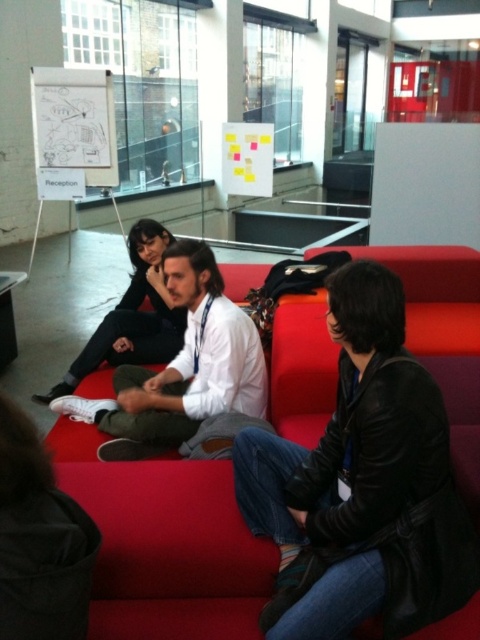
Which is above, white matte shirt at center or matte black jacket at center?

Positioned higher is matte black jacket at center.

I want to click on white matte shirt at center, so click(x=181, y=369).

Which is below, red leather couch at center or matte black jacket at center?

matte black jacket at center is lower down.

Is red leather couch at center positioned at the back of matte black jacket at center?

No.

From the picture: Who is more distant from viewer, [288,438] or [157,252]?

Positioned behind is point [157,252].

The image size is (480, 640). I want to click on red leather couch at center, so click(166, 544).

Can you confirm if red leather couch at center is smaller than white matte shirt at center?

Actually, red leather couch at center might be larger than white matte shirt at center.

Measure the distance between red leather couch at center and camera.

The distance of red leather couch at center from camera is 4.98 feet.

The image size is (480, 640). In order to click on red leather couch at center in this screenshot , I will do `click(166, 544)`.